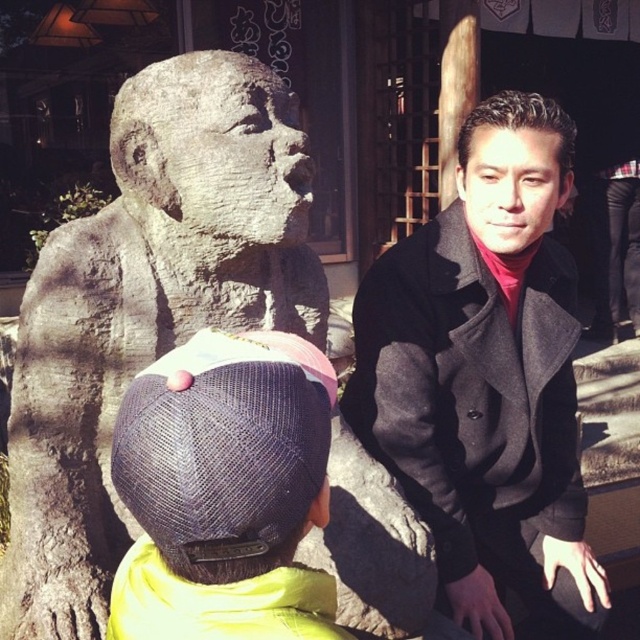
Is gray stone statue at center further to the viewer compared to dark gray wool coat at right?

No.

Can you confirm if gray stone statue at center is shorter than dark gray wool coat at right?

Correct, gray stone statue at center is not as tall as dark gray wool coat at right.

Is point (365, 628) positioned in front of point (580, 534)?

That is True.

This screenshot has width=640, height=640. What are the coordinates of `gray stone statue at center` in the screenshot? It's located at (147, 308).

Can you confirm if gray stone statue at center is bigger than denim cap at lower left?

Yes.

Can you confirm if gray stone statue at center is positioned below denim cap at lower left?

Actually, gray stone statue at center is above denim cap at lower left.

Locate an element on the screen. The height and width of the screenshot is (640, 640). gray stone statue at center is located at coordinates (147, 308).

Which is more to the left, dark gray wool coat at right or denim cap at lower left?

denim cap at lower left is more to the left.

From the picture: Between dark gray wool coat at right and denim cap at lower left, which one appears on the right side from the viewer's perspective?

dark gray wool coat at right is more to the right.

Is point (397, 410) closer to viewer compared to point (138, 628)?

No, it is behind (138, 628).

The height and width of the screenshot is (640, 640). Find the location of `dark gray wool coat at right`. dark gray wool coat at right is located at coordinates (486, 380).